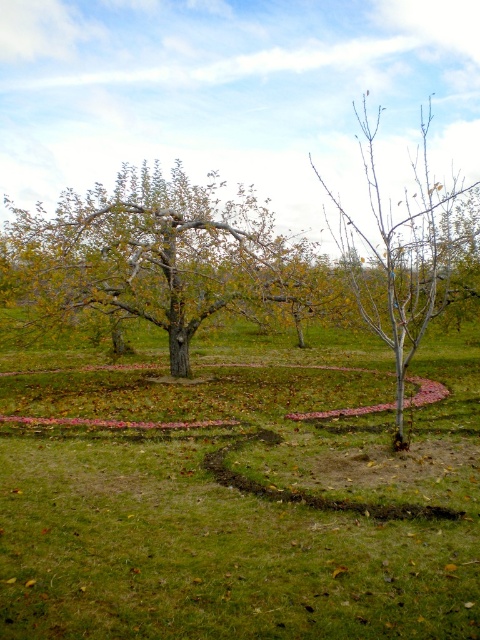
Based on the photo, between green grass at center and bare branches at center, which one appears on the left side from the viewer's perspective?

Positioned to the left is green grass at center.

The height and width of the screenshot is (640, 480). Identify the location of green grass at center. (239, 508).

Who is more forward, [176,388] or [296,276]?

Positioned in front is point [176,388].

Does green grass at center have a greater height compared to green leafy tree at center?

Incorrect, green grass at center's height is not larger of green leafy tree at center's.

The image size is (480, 640). What do you see at coordinates (239, 508) in the screenshot?
I see `green grass at center` at bounding box center [239, 508].

In order to click on green grass at center in this screenshot , I will do `click(239, 508)`.

Is green leafy tree at center further to the viewer compared to bare branches at center?

Yes.

Does point (283, 289) lie in front of point (392, 262)?

No, (283, 289) is behind (392, 262).

Where is `green leafy tree at center`? This screenshot has height=640, width=480. green leafy tree at center is located at coordinates (158, 253).